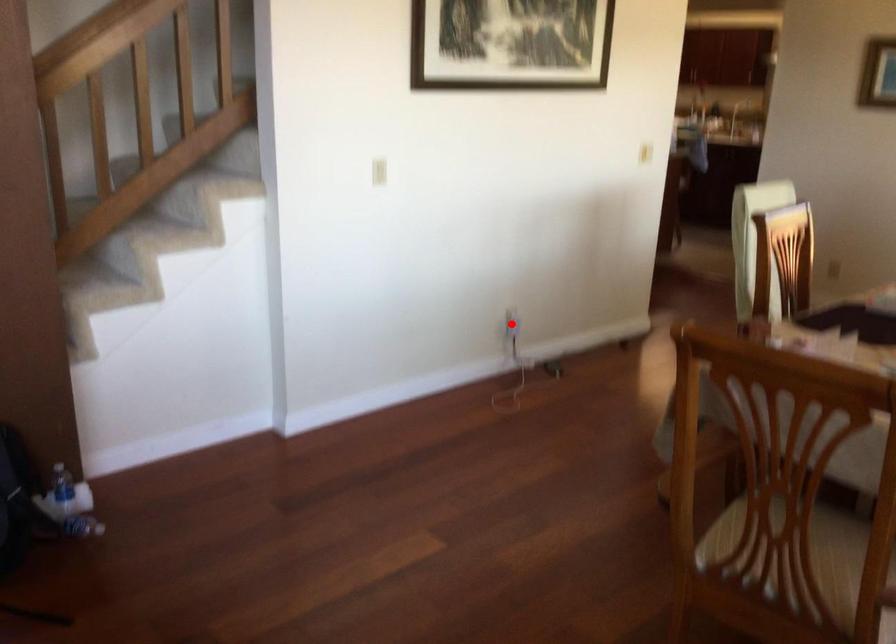
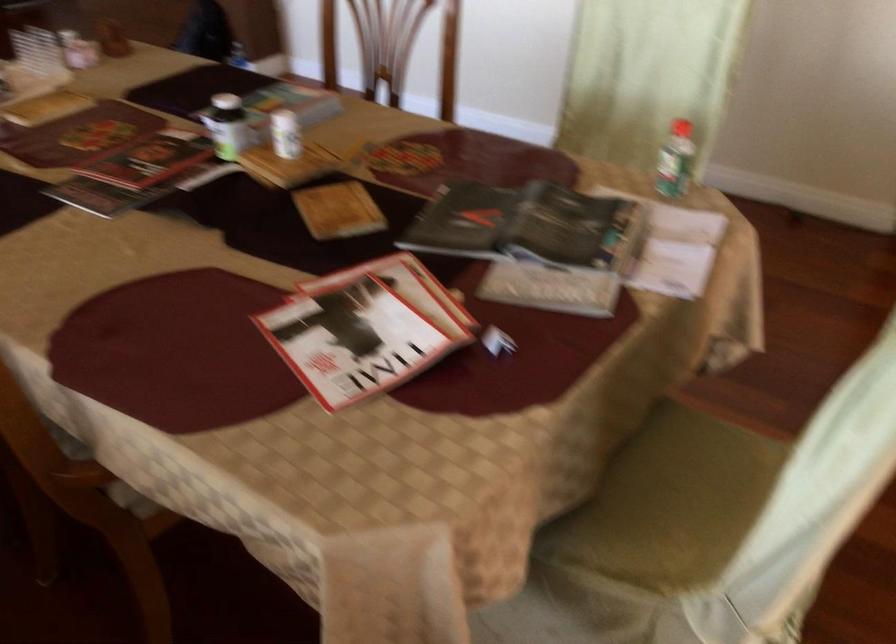
Question: I am providing you with two images of the same scene from different viewpoints. A red point is marked on the first image. At the location where the point appears in image 1, is it still visible in image 2?

Choices:
 (A) Yes
 (B) No

Answer: (B)